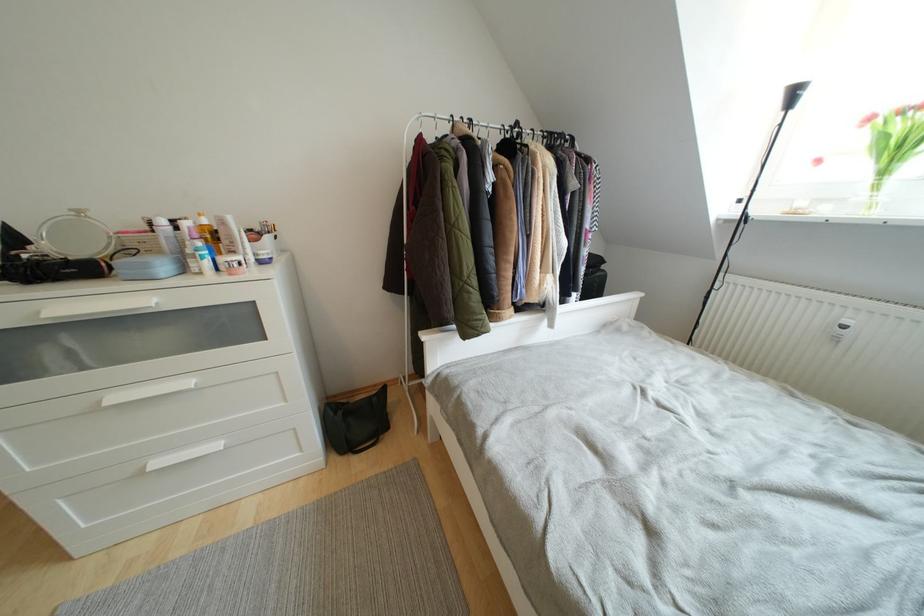
Where is `glass flower vase`? The width and height of the screenshot is (924, 616). glass flower vase is located at coordinates (892, 143).